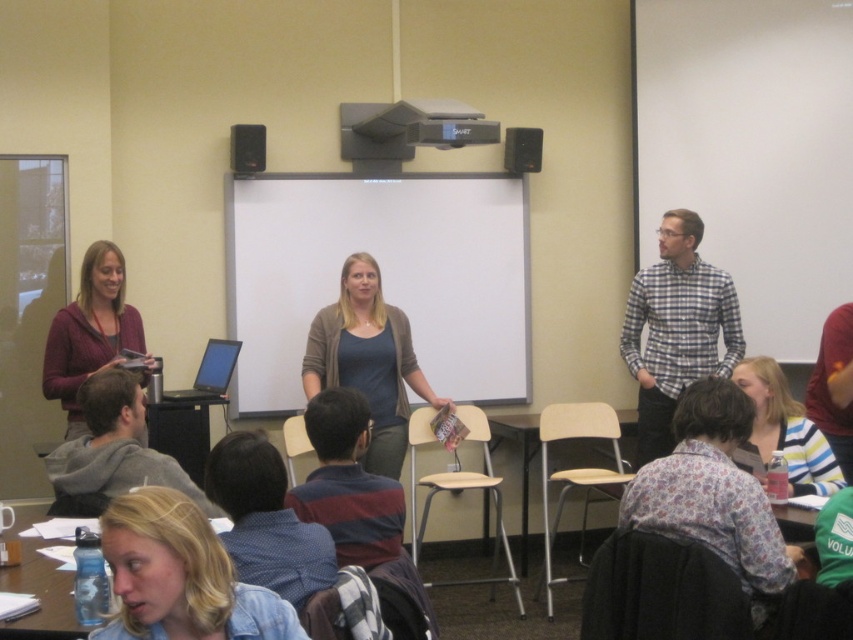
Who is more forward, [137,570] or [199,442]?

Point [137,570] is in front.

Which is more to the left, blonde hair at lower center or black plastic table at lower left?

Positioned to the left is black plastic table at lower left.

Is point (180, 492) closer to camera compared to point (169, 420)?

Yes, point (180, 492) is closer to viewer.

Identify the location of blonde hair at lower center. (181, 577).

Is white matte projection screen at center shorter than clear plastic water bottle at lower left?

In fact, white matte projection screen at center may be taller than clear plastic water bottle at lower left.

Can you confirm if white matte projection screen at center is taller than clear plastic water bottle at lower left?

Yes.

Find the location of `white matte projection screen at center`. white matte projection screen at center is located at coordinates (381, 276).

Between point (335, 364) and point (257, 128), which one is positioned in front?

Positioned in front is point (335, 364).

Based on the photo, who is lower down, matte gray sweater at center or matte black speaker at upper left?

matte gray sweater at center

Is point (370, 413) closer to viewer compared to point (235, 168)?

Yes.

Image resolution: width=853 pixels, height=640 pixels. I want to click on matte gray sweater at center, so click(367, 360).